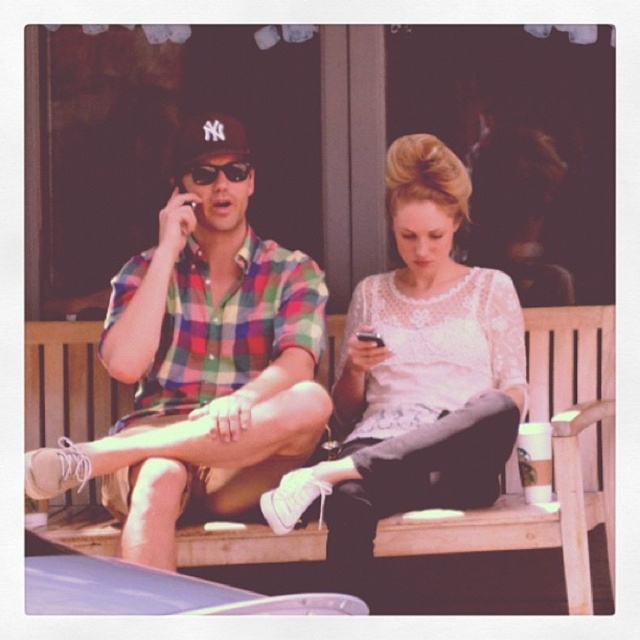
This screenshot has height=640, width=640. Find the location of `plaid fabric shirt at center`. plaid fabric shirt at center is located at coordinates (202, 360).

Based on the photo, does plaid fabric shirt at center appear over wooden bench at center?

Yes, plaid fabric shirt at center is above wooden bench at center.

Between point (243, 419) and point (26, 365), which one is positioned in front?

Point (243, 419) is in front.

In order to click on plaid fabric shirt at center in this screenshot , I will do `click(202, 360)`.

Is point (301, 500) farther from viewer compared to point (90, 545)?

No, it is in front of (90, 545).

Does white lace blouse at center appear on the right side of wooden bench at center?

Yes, white lace blouse at center is to the right of wooden bench at center.

Which is in front, point (384, 445) or point (563, 497)?

Point (384, 445)

Where is `white lace blouse at center`? This screenshot has width=640, height=640. white lace blouse at center is located at coordinates (416, 374).

Which of these two, wooden bench at center or black reflective sunglasses at center, stands taller?

With more height is wooden bench at center.

At what (x,y) coordinates should I click in order to perform the action: click on wooden bench at center. Please return your answer as a coordinate pair (x, y). The image size is (640, 640). Looking at the image, I should click on (554, 460).

Which is behind, point (228, 548) or point (221, 163)?

Positioned behind is point (221, 163).

Locate an element on the screen. wooden bench at center is located at coordinates (554, 460).